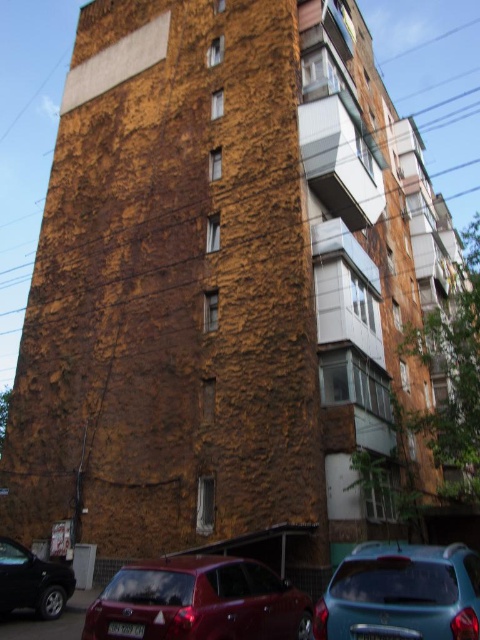
Question: Where is teal matte car at lower right located in relation to shiny black car at lower left in the image?

Choices:
 (A) right
 (B) left

Answer: (A)

Question: Can you confirm if teal matte car at lower right is positioned below shiny black car at lower left?

Choices:
 (A) yes
 (B) no

Answer: (B)

Question: Which of these objects is positioned farthest from the shiny black car at lower left?

Choices:
 (A) teal matte car at lower right
 (B) shiny red sedan at lower center

Answer: (A)

Question: Which of these objects is positioned closest to the shiny red sedan at lower center?

Choices:
 (A) shiny black car at lower left
 (B) teal matte car at lower right

Answer: (B)

Question: Is shiny red sedan at lower center to the right of teal matte car at lower right from the viewer's perspective?

Choices:
 (A) no
 (B) yes

Answer: (A)

Question: Which object is closer to the camera taking this photo?

Choices:
 (A) shiny red sedan at lower center
 (B) shiny black car at lower left
 (C) teal matte car at lower right

Answer: (C)